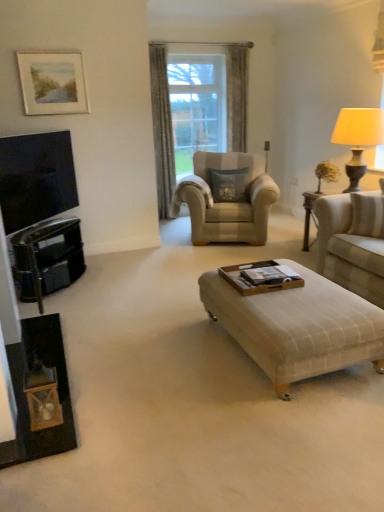
Find the location of `matte black tv at left`. matte black tv at left is located at coordinates (36, 178).

What is the approximate width of matte black tv at left?

The width of matte black tv at left is 7.58 inches.

The height and width of the screenshot is (512, 384). What do you see at coordinates (52, 83) in the screenshot?
I see `matte white picture frame at upper left` at bounding box center [52, 83].

I want to click on black glossy dresser at left, so click(47, 258).

The image size is (384, 512). I want to click on matte beige lampshade at right, so click(x=358, y=138).

Considering the relative sizes of matte white picture frame at upper left and matte beige lampshade at right in the image provided, is matte white picture frame at upper left smaller than matte beige lampshade at right?

Yes.

Is matte white picture frame at upper left positioned far away from matte beige lampshade at right?

Indeed, matte white picture frame at upper left is not near matte beige lampshade at right.

Is matte white picture frame at upper left completely or partially outside of matte beige lampshade at right?

Yes, matte white picture frame at upper left is outside of matte beige lampshade at right.

Is matte white picture frame at upper left facing away from matte beige lampshade at right?

matte white picture frame at upper left is not turned away from matte beige lampshade at right.

Looking at this image, does plaid fabric ottoman at center have a lesser height compared to matte white picture frame at upper left?

Correct, plaid fabric ottoman at center is not as tall as matte white picture frame at upper left.

I want to click on picture frame lying above the plaid fabric ottoman at center (from the image's perspective), so [x=52, y=83].

Based on the photo, between plaid fabric ottoman at center and matte white picture frame at upper left, which one has larger size?

Bigger between the two is plaid fabric ottoman at center.

From a real-world perspective, is plaid fabric ottoman at center physically located above or below matte white picture frame at upper left?

Clearly, from a real-world perspective, plaid fabric ottoman at center is below matte white picture frame at upper left.

Between beige fabric armchair at center and suede gray pillow at center, which one appears on the right side from the viewer's perspective?

Positioned to the right is suede gray pillow at center.

The width and height of the screenshot is (384, 512). Identify the location of chair below the suede gray pillow at center (from the image's perspective). click(226, 202).

Based on the photo, does beige fabric armchair at center have a lesser width compared to suede gray pillow at center?

In fact, beige fabric armchair at center might be wider than suede gray pillow at center.

Between beige fabric armchair at center and suede gray pillow at center, which one has more height?

With more height is beige fabric armchair at center.

Is beige fabric couch at right far away from black glossy dresser at left?

beige fabric couch at right is far away from black glossy dresser at left.

From a real-world perspective, is beige fabric couch at right located beneath black glossy dresser at left?

Incorrect, from a real-world perspective, beige fabric couch at right is higher than black glossy dresser at left.

Based on their sizes in the image, would you say beige fabric couch at right is bigger or smaller than black glossy dresser at left?

beige fabric couch at right is bigger than black glossy dresser at left.

Is suede gray pillow at center facing towards black glossy dresser at left?

No, suede gray pillow at center is not aimed at black glossy dresser at left.

How far apart are suede gray pillow at center and black glossy dresser at left?

A distance of 1.86 meters exists between suede gray pillow at center and black glossy dresser at left.

Which object is positioned more to the left, suede gray pillow at center or black glossy dresser at left?

From the viewer's perspective, black glossy dresser at left appears more on the left side.

Is suede gray pillow at center inside or outside of black glossy dresser at left?

suede gray pillow at center is outside black glossy dresser at left.

Is matte white picture frame at upper left facing away from matte black tv at left?

No, matte white picture frame at upper left is not facing away from matte black tv at left.

From a real-world perspective, is matte white picture frame at upper left physically below matte black tv at left?

Actually, matte white picture frame at upper left is physically above matte black tv at left in the real world.

Considering the sizes of objects matte white picture frame at upper left and matte black tv at left in the image provided, who is shorter, matte white picture frame at upper left or matte black tv at left?

matte white picture frame at upper left.

Considering the points (69, 57) and (35, 191), which point is behind, point (69, 57) or point (35, 191)?

Point (69, 57)

Is beige fabric couch at right further to the viewer compared to gray textured curtain at center?

No, beige fabric couch at right is closer to the viewer.

Is beige fabric couch at right looking in the opposite direction of gray textured curtain at center?

No, beige fabric couch at right is not facing away from gray textured curtain at center.

In terms of width, does beige fabric couch at right look wider or thinner when compared to gray textured curtain at center?

Clearly, beige fabric couch at right has more width compared to gray textured curtain at center.

Does beige fabric couch at right have a lesser height compared to gray textured curtain at center?

Correct, beige fabric couch at right is not as tall as gray textured curtain at center.

The image size is (384, 512). I want to click on table lamp beneath the matte white picture frame at upper left (from a real-world perspective), so click(358, 138).

This screenshot has height=512, width=384. Find the location of `coffee table below the matte white picture frame at upper left (from the image's perspective)`. coffee table below the matte white picture frame at upper left (from the image's perspective) is located at coordinates (297, 325).

Looking at the image, which one is located further to matte beige lampshade at right, beige fabric couch at right or beige fabric armchair at center?

The object further to matte beige lampshade at right is beige fabric armchair at center.

Considering their positions, is gray textured curtain at center positioned further to beige fabric couch at right than beige fabric armchair at center?

Among the two, gray textured curtain at center is located further to beige fabric couch at right.

Considering their positions, is suede gray pillow at center positioned closer to matte black tv at left than matte beige lampshade at right?

suede gray pillow at center is closer to matte black tv at left.

Looking at the image, which one is located closer to gray textured curtain at center, matte black tv at left or suede gray pillow at center?

suede gray pillow at center.

Based on their spatial positions, is suede gray pillow at center or plaid fabric ottoman at center closer to beige fabric couch at right?

plaid fabric ottoman at center is positioned closer to the anchor beige fabric couch at right.

Which object lies further to the anchor point gray textured curtain at center, black glossy dresser at left or matte beige lampshade at right?

The object further to gray textured curtain at center is matte beige lampshade at right.

Which object lies nearer to the anchor point black glossy dresser at left, beige fabric armchair at center or beige fabric couch at right?

Among the two, beige fabric armchair at center is located nearer to black glossy dresser at left.

Based on their spatial positions, is beige fabric couch at right or matte black tv at left closer to black glossy dresser at left?

matte black tv at left is closer to black glossy dresser at left.

This screenshot has width=384, height=512. I want to click on chair positioned between black glossy dresser at left and gray textured curtain at center from near to far, so click(x=226, y=202).

Where is `curtain between matte white picture frame at upper left and matte beige lampshade at right`? curtain between matte white picture frame at upper left and matte beige lampshade at right is located at coordinates (162, 128).

Where is `dresser located between matte white picture frame at upper left and suede gray pillow at center in the left-right direction`? This screenshot has width=384, height=512. dresser located between matte white picture frame at upper left and suede gray pillow at center in the left-right direction is located at coordinates (47, 258).

Image resolution: width=384 pixels, height=512 pixels. In order to click on dresser between matte black tv at left and beige fabric couch at right in the horizontal direction in this screenshot , I will do [x=47, y=258].